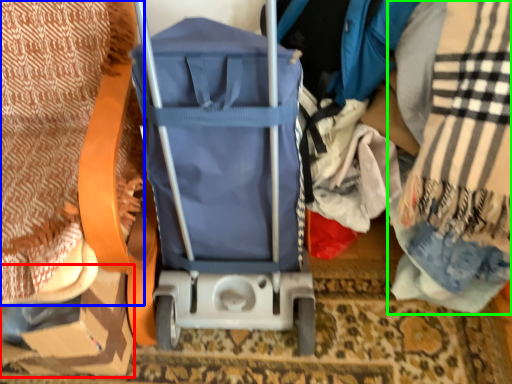
Question: Estimate the real-world distances between objects in this image. Which object is farther from cardboard box (highlighted by a red box), blanket (highlighted by a blue box) or blanket (highlighted by a green box)?

Choices:
 (A) blanket
 (B) blanket

Answer: (B)